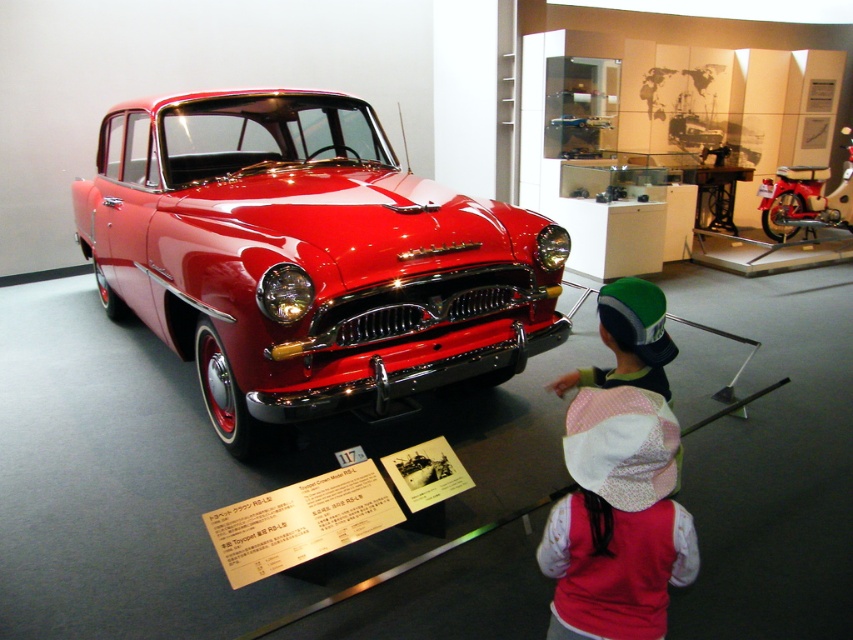
Question: Is shiny red car at center positioned before pink fabric hat at lower center?

Choices:
 (A) yes
 (B) no

Answer: (B)

Question: Which of the following is the closest to the observer?

Choices:
 (A) pink fabric hat at lower center
 (B) shiny red car at center

Answer: (A)

Question: Does shiny red car at center have a smaller size compared to pink fabric hat at lower center?

Choices:
 (A) no
 (B) yes

Answer: (A)

Question: Which of the following is the farthest from the observer?

Choices:
 (A) (329, 410)
 (B) (582, 573)

Answer: (A)

Question: Which point appears farthest from the camera in this image?

Choices:
 (A) (219, 156)
 (B) (570, 449)

Answer: (A)

Question: Can you confirm if shiny red car at center is wider than pink fabric hat at lower center?

Choices:
 (A) yes
 (B) no

Answer: (A)